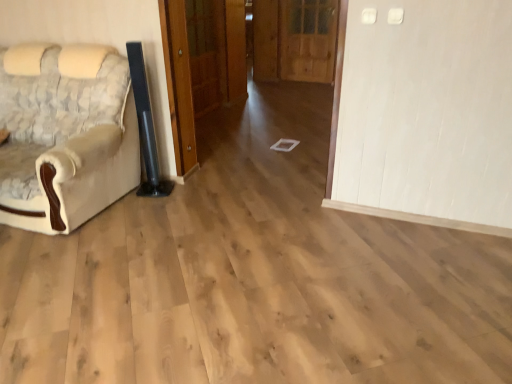
Question: Considering the relative positions of wooden door at center, placed as the 1th door when sorted from left to right, and wooden door at center, which is counted as the second door, starting from the left, in the image provided, is wooden door at center, placed as the 1th door when sorted from left to right, to the left or to the right of wooden door at center, which is counted as the second door, starting from the left,?

Choices:
 (A) right
 (B) left

Answer: (B)

Question: From a real-world perspective, is wooden door at center, which is the 3th door from right to left, positioned above or below wooden door at center, which is counted as the second door, starting from the left?

Choices:
 (A) below
 (B) above

Answer: (B)

Question: Which object is the farthest from the wooden door at center, which is the 3th door from right to left?

Choices:
 (A) wooden door at center, which is counted as the second door, starting from the left
 (B) wooden door at center, which is the third door in left-to-right order
 (C) beige fabric chair at left

Answer: (C)

Question: Estimate the real-world distances between objects in this image. Which object is farther from the beige fabric chair at left?

Choices:
 (A) wooden door at center, placed as the 1th door when sorted from left to right
 (B) wooden door at center, which is the third door in left-to-right order
 (C) wooden door at center, the second door from the right

Answer: (B)